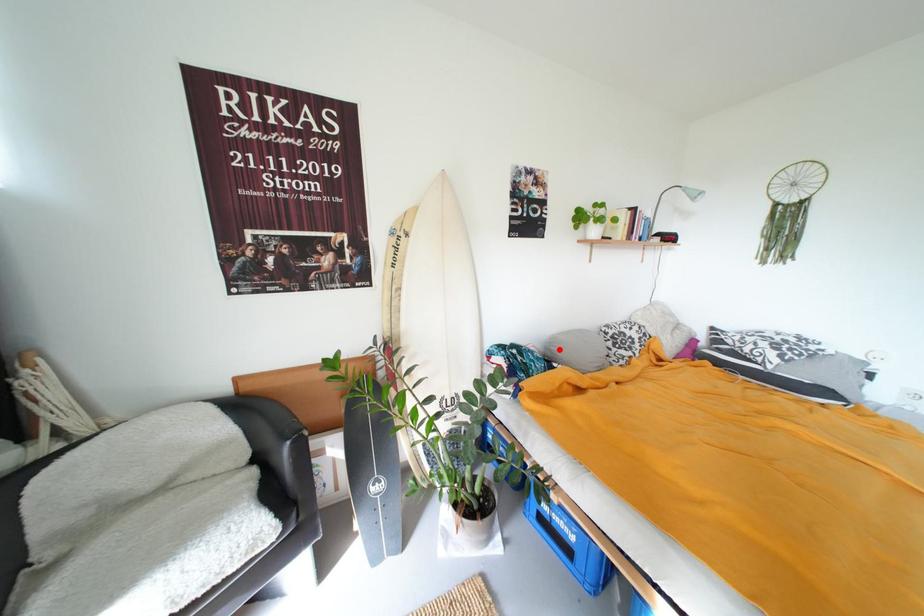
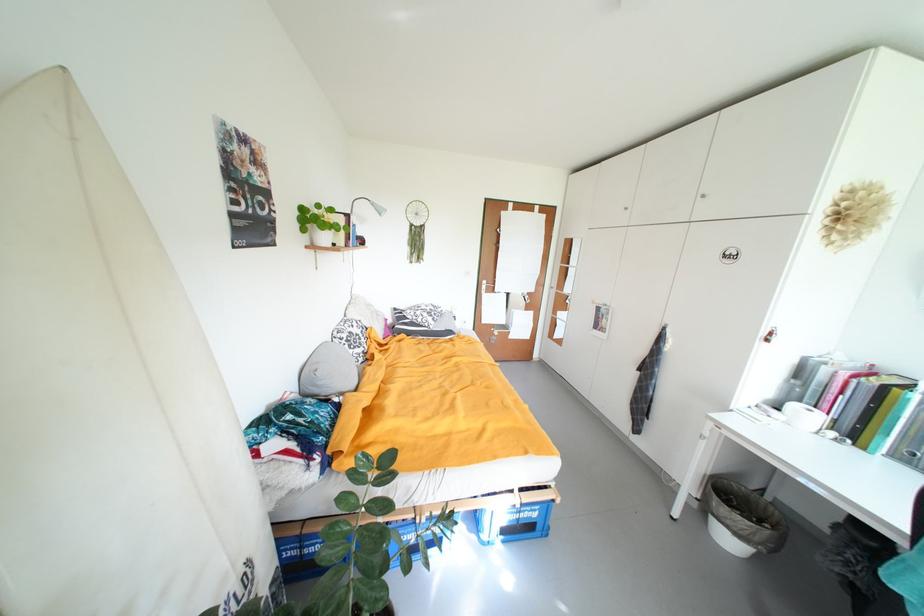
Question: I am providing you with two images of the same scene from different viewpoints. A red point is shown in image1. For the corresponding object point in image2, is it positioned nearer or farther from the camera?

Choices:
 (A) Nearer
 (B) Farther

Answer: (A)